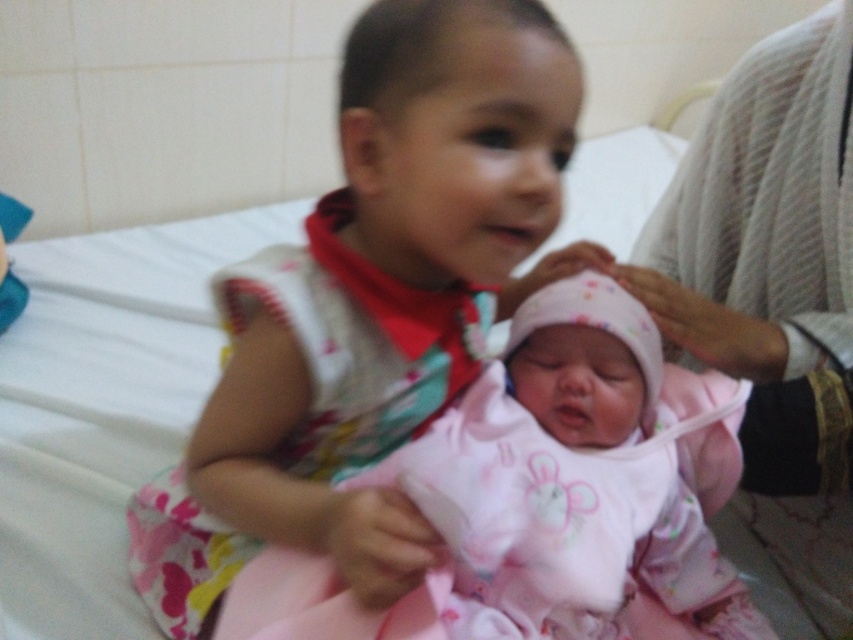
Between matte pink dress at center and pink fabric baby at center, which one has less height?

With less height is pink fabric baby at center.

Describe the element at coordinates (370, 304) in the screenshot. I see `matte pink dress at center` at that location.

Where is `matte pink dress at center`? matte pink dress at center is located at coordinates (370, 304).